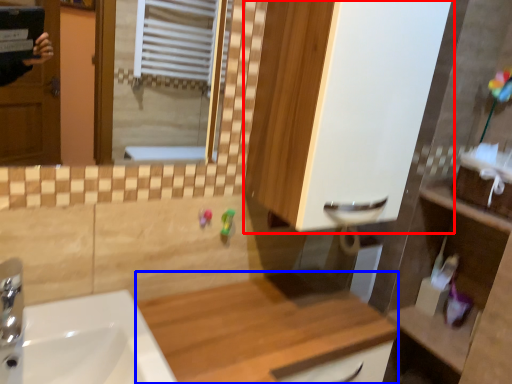
Question: Which of the following is the closest to the observer, cabinetry (highlighted by a red box) or counter top (highlighted by a blue box)?

Choices:
 (A) cabinetry
 (B) counter top

Answer: (B)